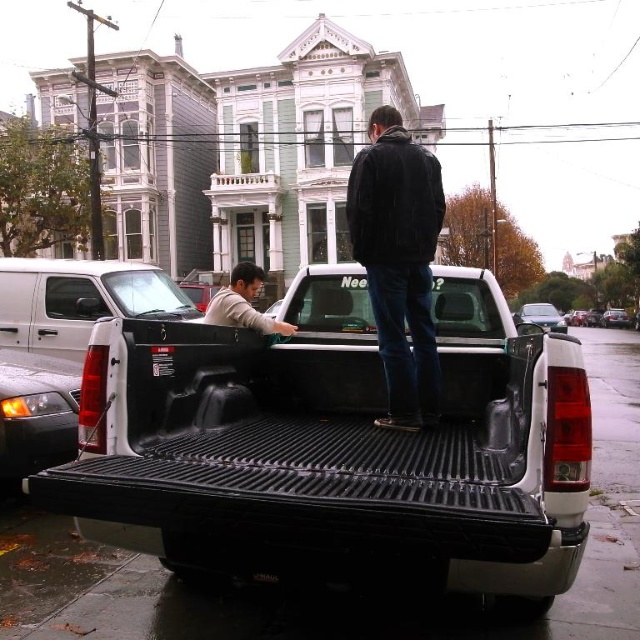
You are a delivery person who needs to load a package into the truck bed. The package requires a minimum of 20 feet of space to fit. Can you determine if the distance between the black textured truck bed at center and the white matte truck bed at center is sufficient?

The distance between the black textured truck bed at center and the white matte truck bed at center is 19.05 feet, which is less than the required 20 feet. Therefore, the package will not fit in the available space.

You are a delivery person who needs to place a package at the exact location of point (337, 445) in the image. Where should you place it?

Place the package on the black textured truck bed at center, as the point (337, 445) is located there.